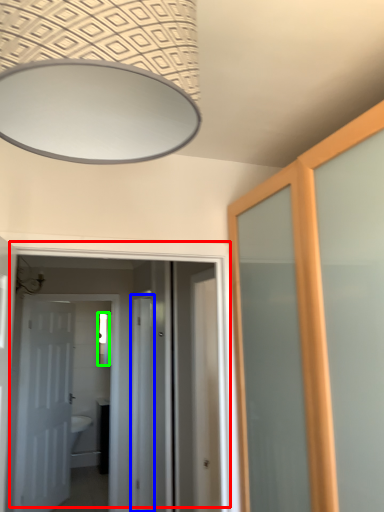
Question: Estimate the real-world distances between objects in this image. Which object is farther from door (highlighted by a red box), screen door (highlighted by a blue box) or mirror (highlighted by a green box)?

Choices:
 (A) screen door
 (B) mirror

Answer: (B)